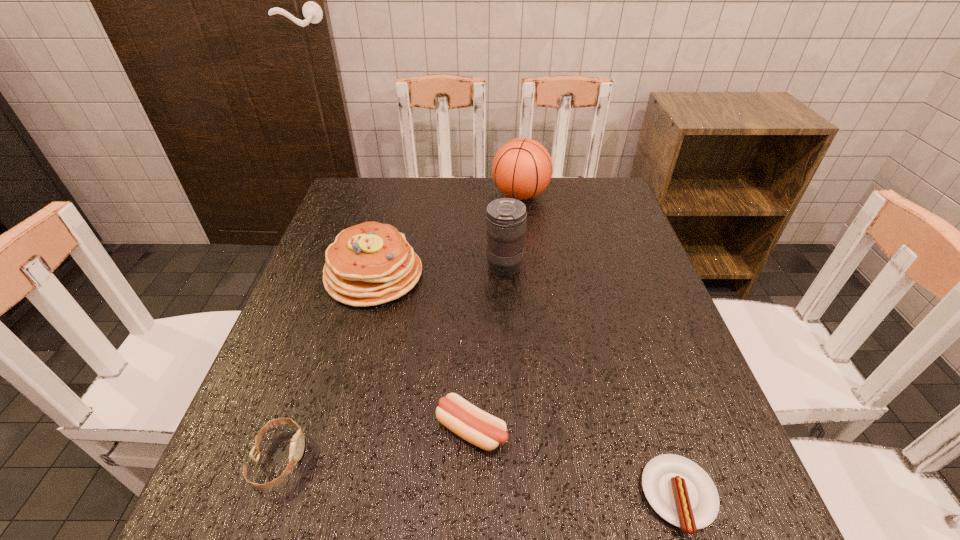
Locate an element on the screen. vacant space that satisfies the following two spatial constraints: 1. on the front side of the pancake; 2. on the right side of the shortest object is located at coordinates (316, 496).

Locate an element on the screen. free spot that satisfies the following two spatial constraints: 1. on the back side of the shorter sausage; 2. on the face of the watch is located at coordinates (667, 458).

Locate an element on the screen. This screenshot has height=540, width=960. vacant point that satisfies the following two spatial constraints: 1. on the face of the watch; 2. on the right side of the shorter sausage is located at coordinates (266, 496).

The width and height of the screenshot is (960, 540). In order to click on vacant space that satisfies the following two spatial constraints: 1. on the face of the rightmost object; 2. on the right side of the watch in this screenshot , I will do `click(266, 496)`.